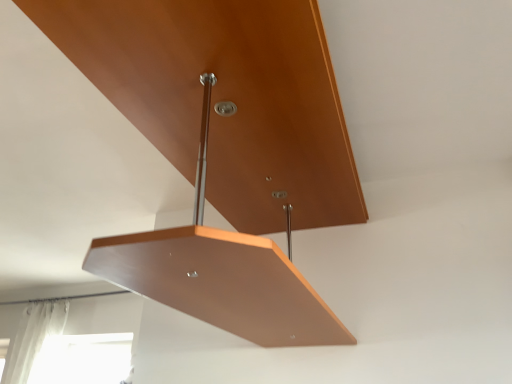
In order to click on matte wood shelf at center in this screenshot , I will do `click(223, 150)`.

The image size is (512, 384). Describe the element at coordinates (223, 150) in the screenshot. I see `matte wood shelf at center` at that location.

The height and width of the screenshot is (384, 512). Describe the element at coordinates (35, 340) in the screenshot. I see `white sheer curtain at lower left` at that location.

Measure the distance between point (x=42, y=340) and camera.

11.88 feet.

At what (x,y) coordinates should I click in order to perform the action: click on white sheer curtain at lower left. Please return your answer as a coordinate pair (x, y). The width and height of the screenshot is (512, 384). Looking at the image, I should click on (35, 340).

At what (x,y) coordinates should I click in order to perform the action: click on matte wood shelf at center. Please return your answer as a coordinate pair (x, y). The image size is (512, 384). Looking at the image, I should click on pos(223,150).

Which is more to the right, matte wood shelf at center or white sheer curtain at lower left?

From the viewer's perspective, matte wood shelf at center appears more on the right side.

Based on the photo, is matte wood shelf at center positioned behind white sheer curtain at lower left?

No, matte wood shelf at center is in front of white sheer curtain at lower left.

Which is in front, point (151, 248) or point (28, 358)?

The point (151, 248) is more forward.

From the image's perspective, is matte wood shelf at center located beneath white sheer curtain at lower left?

Actually, matte wood shelf at center appears above white sheer curtain at lower left in the image.

From a real-world perspective, which object rests below the other?

white sheer curtain at lower left, from a real-world perspective.

Which object is thinner, matte wood shelf at center or white sheer curtain at lower left?

With smaller width is white sheer curtain at lower left.

Considering the relative sizes of matte wood shelf at center and white sheer curtain at lower left in the image provided, is matte wood shelf at center taller than white sheer curtain at lower left?

No, matte wood shelf at center is not taller than white sheer curtain at lower left.

Based on the photo, who is bigger, matte wood shelf at center or white sheer curtain at lower left?

Bigger between the two is matte wood shelf at center.

Is matte wood shelf at center outside of white sheer curtain at lower left?

matte wood shelf at center is positioned outside white sheer curtain at lower left.

Does matte wood shelf at center touch white sheer curtain at lower left?

No, matte wood shelf at center is not touching white sheer curtain at lower left.

Is white sheer curtain at lower left at the back of matte wood shelf at center?

Yes.

What's the angular difference between matte wood shelf at center and white sheer curtain at lower left's facing directions?

89.8 degrees separate the facing orientations of matte wood shelf at center and white sheer curtain at lower left.

I want to click on curtain below the matte wood shelf at center (from a real-world perspective), so click(35, 340).

Can you confirm if white sheer curtain at lower left is positioned to the right of matte wood shelf at center?

No, white sheer curtain at lower left is not to the right of matte wood shelf at center.

Which is behind, white sheer curtain at lower left or matte wood shelf at center?

white sheer curtain at lower left is further away from the camera.

Which is more distant, (28, 380) or (257, 195)?

Positioned behind is point (28, 380).

From the image's perspective, which is above, white sheer curtain at lower left or matte wood shelf at center?

matte wood shelf at center.

From a real-world perspective, is white sheer curtain at lower left on top of matte wood shelf at center?

No, from a real-world perspective, white sheer curtain at lower left is not on top of matte wood shelf at center.

Considering the sizes of objects white sheer curtain at lower left and matte wood shelf at center in the image provided, who is wider, white sheer curtain at lower left or matte wood shelf at center?

With larger width is matte wood shelf at center.

Is white sheer curtain at lower left taller or shorter than matte wood shelf at center?

Considering their sizes, white sheer curtain at lower left has more height than matte wood shelf at center.

Can you confirm if white sheer curtain at lower left is smaller than matte wood shelf at center?

Indeed, white sheer curtain at lower left has a smaller size compared to matte wood shelf at center.

Is white sheer curtain at lower left not within matte wood shelf at center?

white sheer curtain at lower left is positioned outside matte wood shelf at center.

Would you say white sheer curtain at lower left is a long distance from matte wood shelf at center?

white sheer curtain at lower left is positioned a significant distance from matte wood shelf at center.

Looking at this image, is white sheer curtain at lower left oriented away from matte wood shelf at center?

No.

How different are the orientations of white sheer curtain at lower left and matte wood shelf at center in degrees?

There is a 89.8-degree angle between the facing directions of white sheer curtain at lower left and matte wood shelf at center.

At what (x,y) coordinates should I click in order to perform the action: click on furniture in front of the white sheer curtain at lower left. Please return your answer as a coordinate pair (x, y). Looking at the image, I should click on (223, 150).

In the image, there is a matte wood shelf at center. In order to click on curtain below it (from the image's perspective) in this screenshot , I will do `click(35, 340)`.

You are a GUI agent. You are given a task and a screenshot of the screen. Output one action in this format:
    pyautogui.click(x=<x>, y=<y>)
    Task: Click on the curtain behind the matte wood shelf at center
    This screenshot has height=384, width=512.
    Given the screenshot: What is the action you would take?
    pyautogui.click(x=35, y=340)